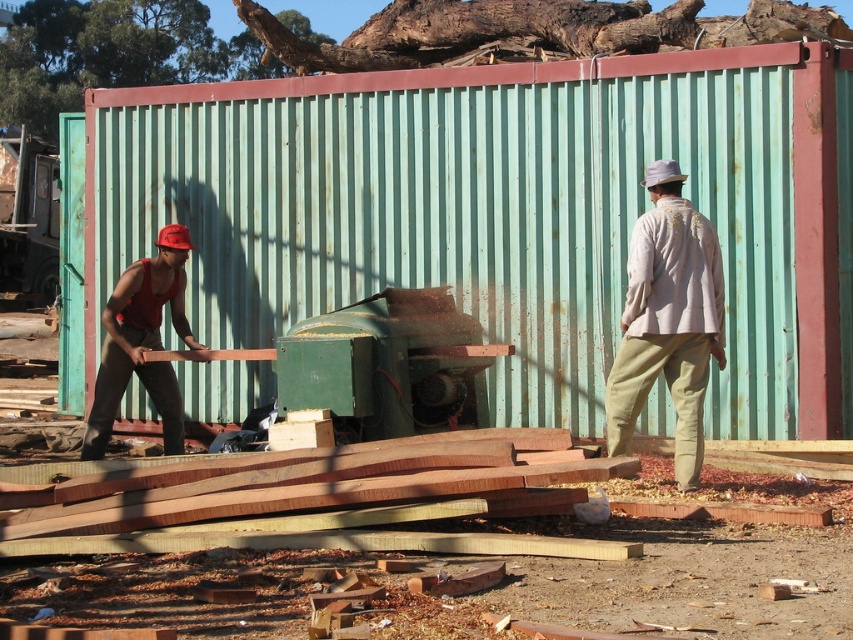
Is light beige cotton shirt at center closer to camera compared to red matte tank top at left?

Yes.

Can you confirm if light beige cotton shirt at center is taller than red matte tank top at left?

Indeed, light beige cotton shirt at center has a greater height compared to red matte tank top at left.

Describe the element at coordinates (668, 321) in the screenshot. I see `light beige cotton shirt at center` at that location.

The width and height of the screenshot is (853, 640). Find the location of `light beige cotton shirt at center`. light beige cotton shirt at center is located at coordinates (668, 321).